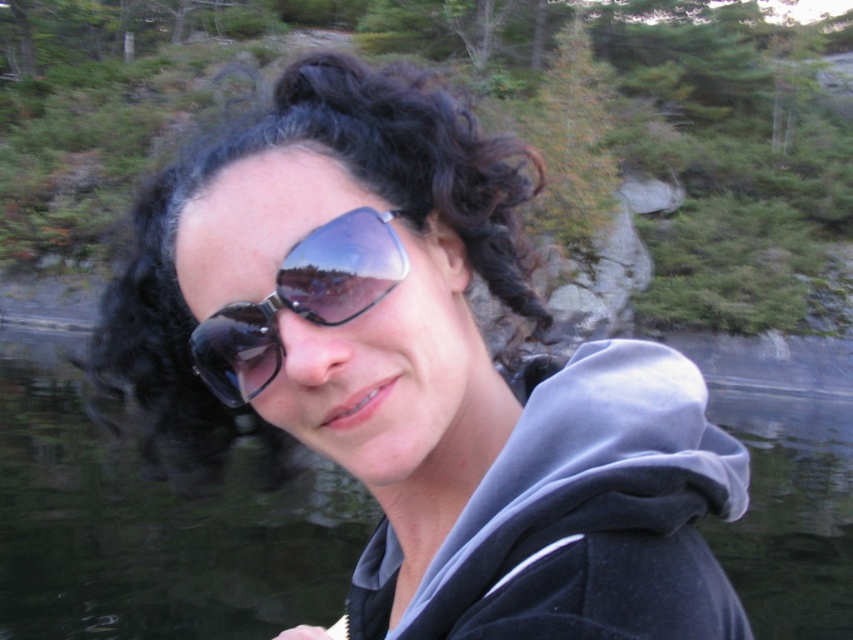
Question: Is matte black sunglasses at center positioned at the back of transparent water at center?

Choices:
 (A) no
 (B) yes

Answer: (B)

Question: Among these points, which one is nearest to the camera?

Choices:
 (A) click(x=254, y=346)
 (B) click(x=78, y=540)
 (C) click(x=442, y=490)

Answer: (A)

Question: Which object is the closest to the transparent water at center?

Choices:
 (A) shiny black sunglasses at center
 (B) matte black sunglasses at center

Answer: (A)

Question: Which object appears closest to the camera in this image?

Choices:
 (A) matte black sunglasses at center
 (B) shiny black sunglasses at center

Answer: (B)

Question: Does transparent water at center lie behind shiny black sunglasses at center?

Choices:
 (A) no
 (B) yes

Answer: (B)

Question: Does matte black sunglasses at center have a smaller size compared to shiny black sunglasses at center?

Choices:
 (A) no
 (B) yes

Answer: (B)